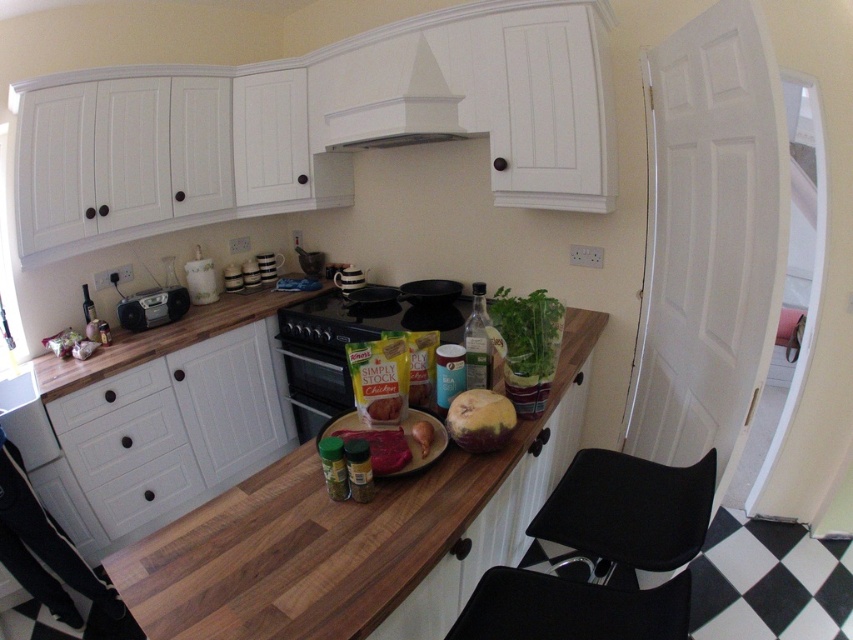
Does black matte stove at center have a lesser width compared to smooth brown chicken at center?

No.

Is black matte stove at center taller than smooth brown chicken at center?

Yes, black matte stove at center is taller than smooth brown chicken at center.

Locate an element on the screen. The height and width of the screenshot is (640, 853). black matte stove at center is located at coordinates (369, 320).

You are a GUI agent. You are given a task and a screenshot of the screen. Output one action in this format:
    pyautogui.click(x=<x>, y=<y>)
    Task: Click on the white wood drawer at lower left
    Image resolution: width=853 pixels, height=640 pixels.
    Given the screenshot: What is the action you would take?
    pyautogui.click(x=107, y=394)

Identify the location of white wood drawer at lower left. The width and height of the screenshot is (853, 640). (107, 394).

Does green leafy vegetable at center lie behind smooth red paste at center?

That is True.

Where is `green leafy vegetable at center`? This screenshot has height=640, width=853. green leafy vegetable at center is located at coordinates (527, 333).